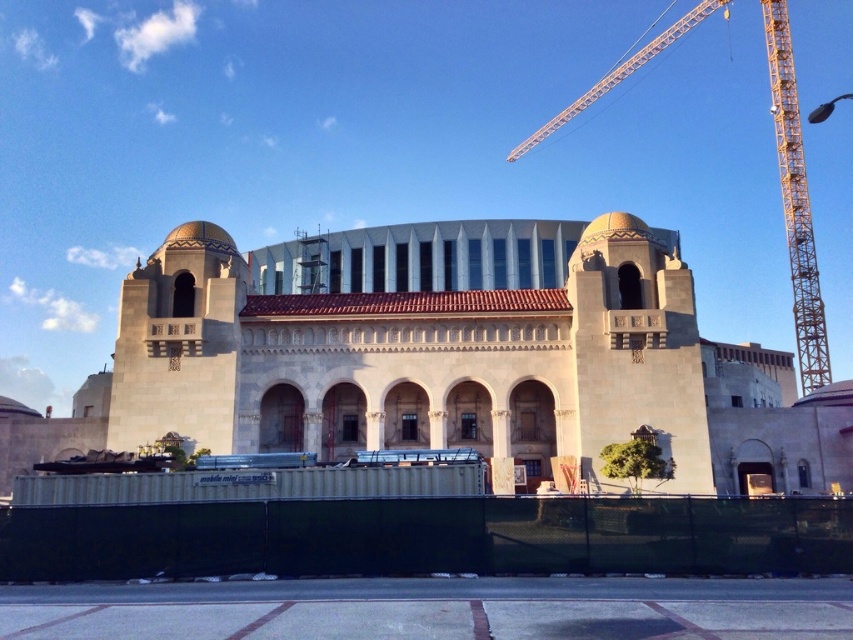
Is beige stone building at center taller than yellow metal crane at upper right?

In fact, beige stone building at center may be shorter than yellow metal crane at upper right.

Which is in front, point (540, 252) or point (798, 308)?

Point (540, 252) is in front.

Find the location of a particular element. Image resolution: width=853 pixels, height=640 pixels. beige stone building at center is located at coordinates (416, 356).